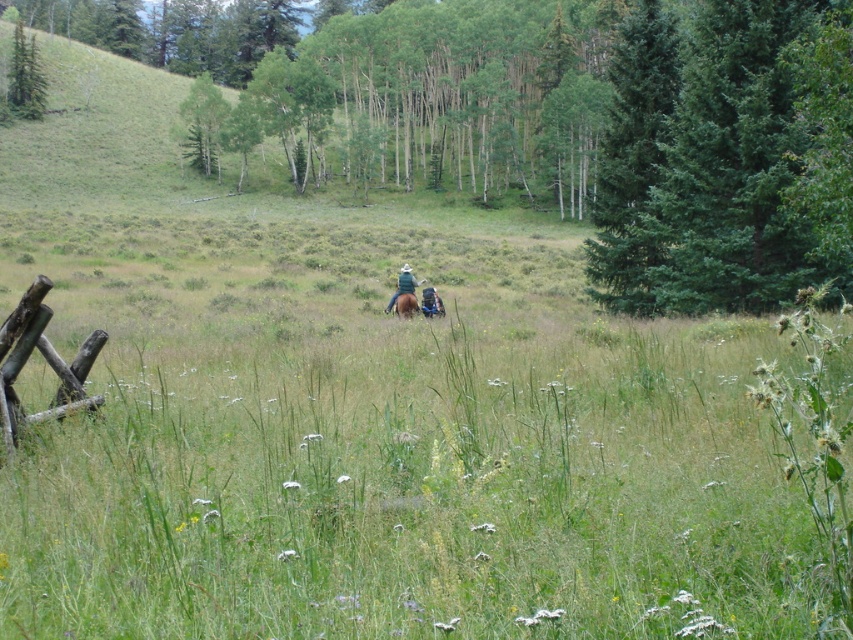
Question: Is green grassy field at center in front of green felt hat at center?

Choices:
 (A) no
 (B) yes

Answer: (B)

Question: Does brown wooden fence at lower left have a lesser width compared to brown matte horse at center?

Choices:
 (A) no
 (B) yes

Answer: (B)

Question: Which object appears farthest from the camera in this image?

Choices:
 (A) green evergreen tree at upper right
 (B) green felt hat at center
 (C) brown wooden fence at lower left

Answer: (B)

Question: Which point is closer to the camera taking this photo?

Choices:
 (A) (419, 566)
 (B) (628, 179)
 (C) (407, 288)
 (D) (401, 296)

Answer: (A)

Question: Which object appears farthest from the camera in this image?

Choices:
 (A) green matte tree at upper left
 (B) green grassy field at center

Answer: (A)

Question: Does brown wooden fence at lower left appear over green matte tree at upper left?

Choices:
 (A) yes
 (B) no

Answer: (B)